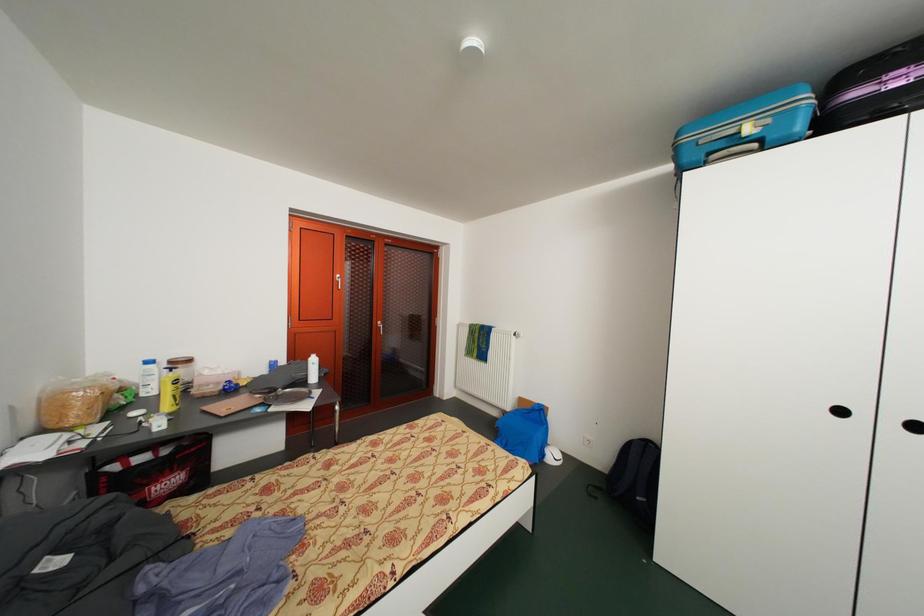
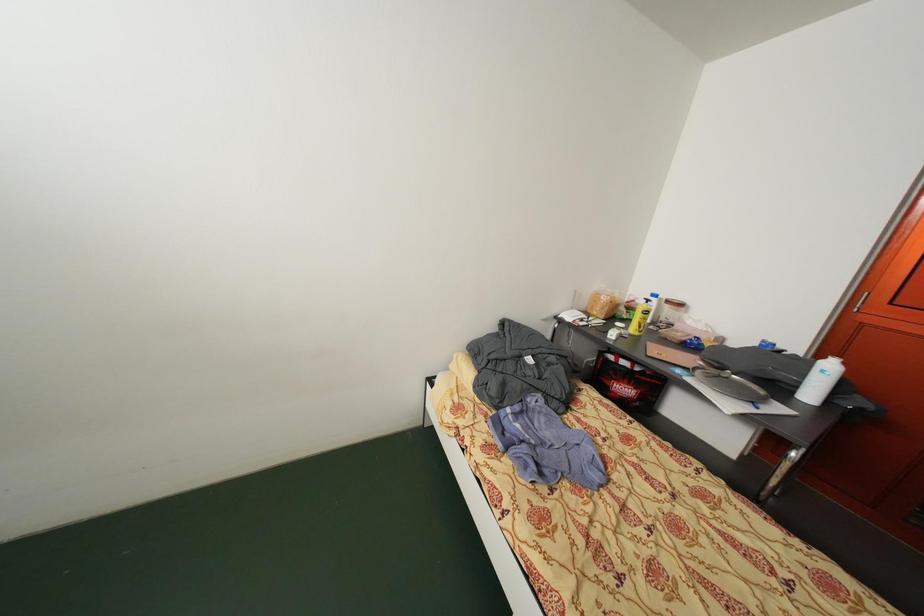
Based on the continuous images, in which direction is the camera rotating?

The camera rotated toward left-down.